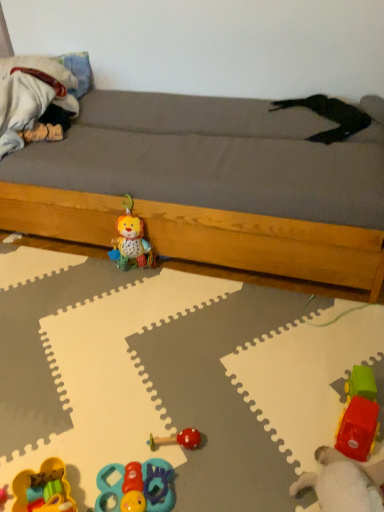
Locate an element on the screen. Image resolution: width=384 pixels, height=512 pixels. vacant space to the left of rubberized plastic car at lower right, the fifth toy when ordered from left to right is located at coordinates (236, 462).